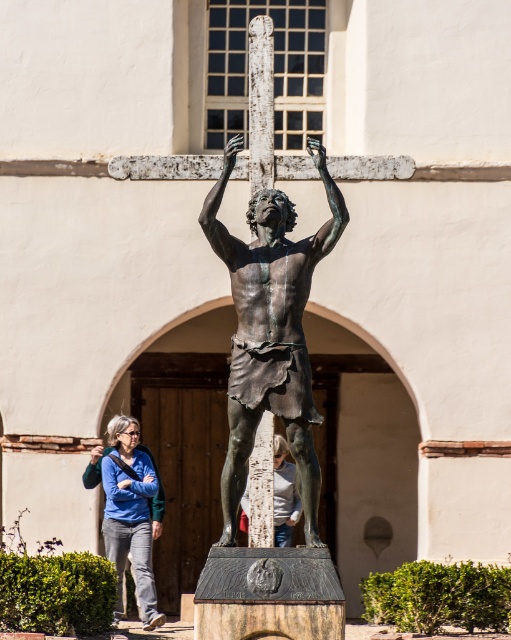
You are standing in front of the statue and need to place a small plaque exactly at the base of the bronze statue at center. According to the coordinates provided, where should you position the plaque?

A: The bronze statue at center is located at point coordinates (270, 330), so you should position the plaque at those coordinates at the base of the statue.

You are an artist trying to sketch the scene. You notice the blue denim jeans at lower left and the white cotton shirt at center. Which clothing item appears narrower in the image?

The blue denim jeans at lower left are narrower than the white cotton shirt at center because the blue denim jeans at lower left has a smaller width.

You are a photographer positioned at the base of the statue. You want to capture both the blue denim jeans at lower left and the white cotton shirt at center in a single frame. Your camera has a maximum focus range of 6 meters. Will you be able to include both objects in your shot?

The distance between the blue denim jeans at lower left and the white cotton shirt at center is 6.77 meters. Since your camera can only focus up to 6 meters, you won not be able to capture both objects in a single frame as the distance exceeds the maximum range.